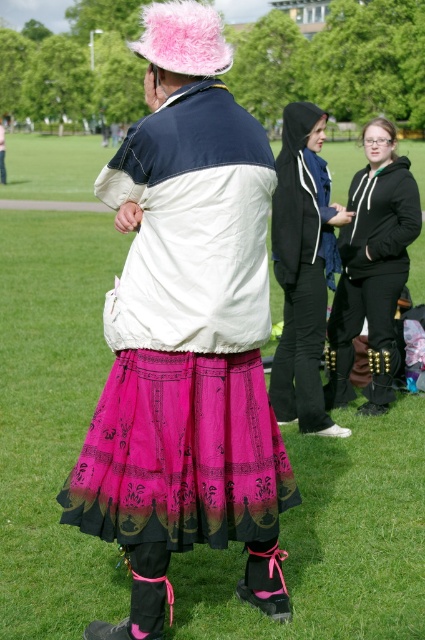
You are standing in the grassy field and want to take a photo of the person in the distinctive outfit. The pink sheer skirt at center is part of their outfit. Where should you position yourself relative to the skirt to ensure the entire outfit is visible in the frame?

Since the pink sheer skirt at center is located at point (187, 339), you should position yourself directly in front of the skirt to capture the entire outfit in the frame.

You are standing at the point with coordinates point (393, 298) and want to move to the point (312, 300). Can you see the person in the pink hat from your current position?

Yes, because point (312, 300) is in front of point (393, 298), so the person in the pink hat at point (312, 300) would be visible from point (393, 298).

You are standing at the origin point of the coordinate system in the image. You want to move towards the black hoodie at center. What direction should you move in?

The black hoodie at center is located at coordinate point 0.420 on the x axis and 0.713 on the y axis. Since you are at the origin, you should move towards the positive x and positive y direction to reach the black hoodie at center.